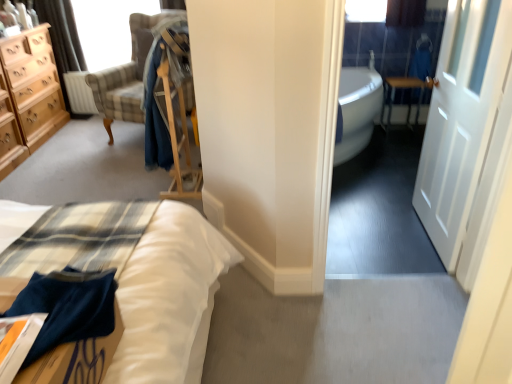
Question: Visually, is clear glass window screen at upper left positioned to the left or to the right of metallic silver table at right?

Choices:
 (A) right
 (B) left

Answer: (B)

Question: Is clear glass window screen at upper left in front of or behind metallic silver table at right in the image?

Choices:
 (A) behind
 (B) front

Answer: (B)

Question: Which is nearer to the matte beige curtain at upper left?

Choices:
 (A) metallic silver table at right
 (B) light wood chest of drawers at left
 (C) blue cotton robe at center
 (D) white leather bed at lower left
 (E) white glossy bathtub at right

Answer: (B)

Question: Estimate the real-world distances between objects in this image. Which object is farther from the blue cotton robe at center?

Choices:
 (A) white leather bed at lower left
 (B) matte beige curtain at upper left
 (C) plaid fabric chair at upper left
 (D) white glossy bathtub at right
 (E) light wood chest of drawers at left

Answer: (B)